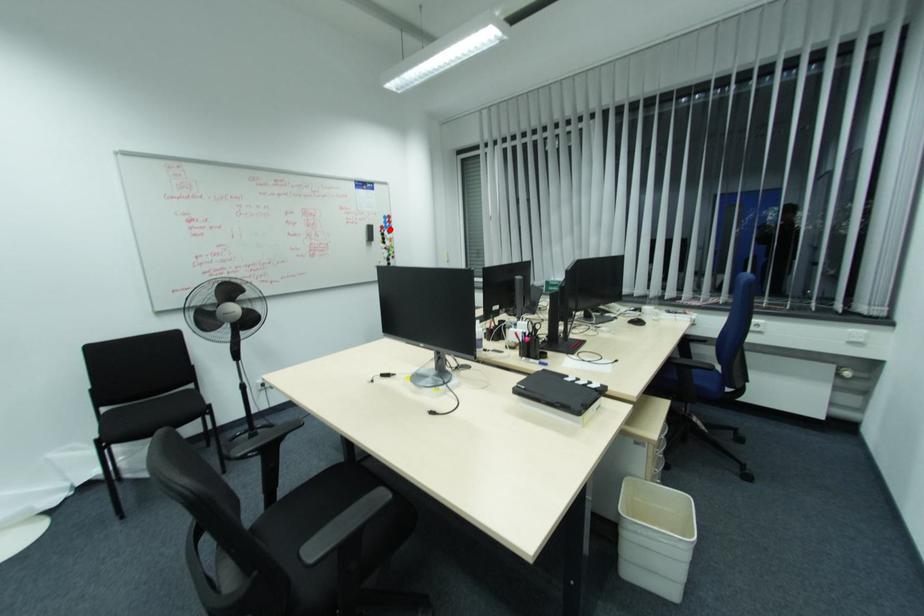
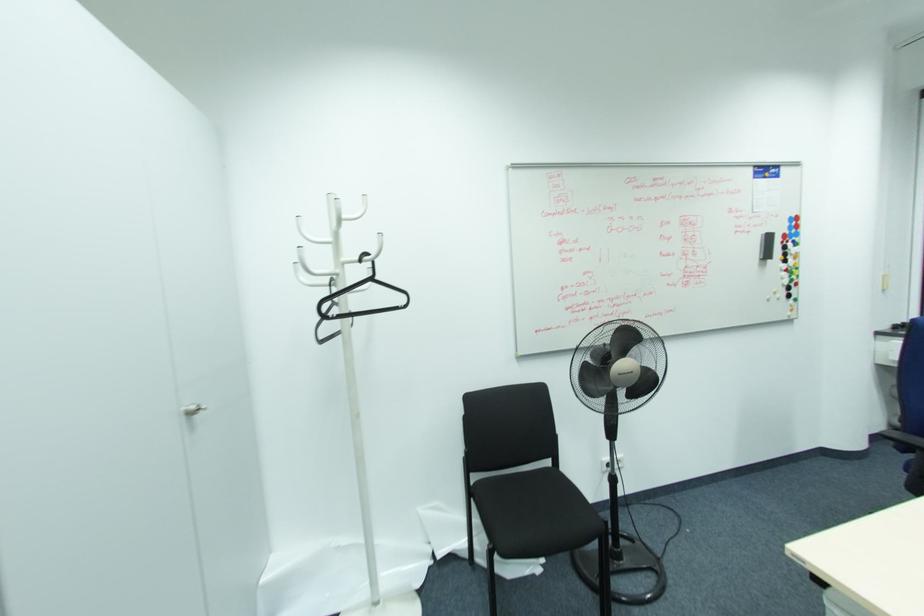
Locate, in the second image, the point that corresponds to the highlighted location in the first image.

(796, 238)